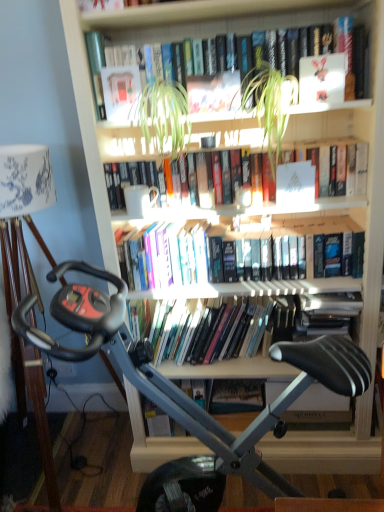
Question: From a real-world perspective, does hardcover book at upper center, which is counted as the first book, starting from the top, stand above matte paper paperback at center, arranged as the first paperback book when ordered from the bottom?

Choices:
 (A) no
 (B) yes

Answer: (B)

Question: Considering the relative sizes of hardcover book at upper center, the fourth book from the bottom, and matte paper paperback at center, arranged as the first paperback book when ordered from the bottom, in the image provided, is hardcover book at upper center, the fourth book from the bottom, thinner than matte paper paperback at center, arranged as the first paperback book when ordered from the bottom,?

Choices:
 (A) no
 (B) yes

Answer: (A)

Question: Is hardcover book at upper center, which is counted as the first book, starting from the top, outside matte paper paperback at center, the third paperback book in the right-to-left sequence?

Choices:
 (A) yes
 (B) no

Answer: (A)

Question: From the image's perspective, does hardcover book at upper center, the fourth book from the bottom, appear lower than matte paper paperback at center, the 1th paperback book positioned from the back?

Choices:
 (A) no
 (B) yes

Answer: (A)

Question: Can you confirm if hardcover book at upper center, which is counted as the first book, starting from the top, is taller than matte paper paperback at center, arranged as the first paperback book when ordered from the bottom?

Choices:
 (A) yes
 (B) no

Answer: (A)

Question: Is matte paper paperback at center, marked as the fourth paperback book in a top-to-bottom arrangement, at the back of hardcover book at upper center, which is counted as the first book, starting from the top?

Choices:
 (A) no
 (B) yes

Answer: (A)

Question: Is hardcover books at center, marked as the 3th book in a top-to-bottom arrangement, beside matte paper book at upper center, arranged as the 3th paperback book when ordered from the bottom?

Choices:
 (A) no
 (B) yes

Answer: (A)

Question: Is the position of hardcover books at center, the 2th book ordered from the bottom, less distant than that of matte paper book at upper center, arranged as the 3th paperback book when ordered from the bottom?

Choices:
 (A) no
 (B) yes

Answer: (A)

Question: Is matte paper book at upper center, the third paperback book when ordered from front to back, at the back of hardcover books at center, marked as the 3th book in a top-to-bottom arrangement?

Choices:
 (A) yes
 (B) no

Answer: (B)

Question: From a real-world perspective, is hardcover books at center, the 2th book ordered from the bottom, over matte paper book at upper center, arranged as the 3th paperback book when ordered from the bottom?

Choices:
 (A) yes
 (B) no

Answer: (B)

Question: Does hardcover books at center, marked as the 3th book in a top-to-bottom arrangement, appear on the right side of matte paper book at upper center, which is counted as the 1th paperback book, starting from the left?

Choices:
 (A) yes
 (B) no

Answer: (A)

Question: Can you confirm if hardcover books at center, the 2th book ordered from the bottom, is bigger than matte paper book at upper center, the 4th paperback book from the right?

Choices:
 (A) yes
 (B) no

Answer: (A)

Question: Is green leafy plant at upper center, positioned as the second plant in left-to-right order, taller than hardcover book at upper center, which is counted as the first book, starting from the top?

Choices:
 (A) yes
 (B) no

Answer: (A)